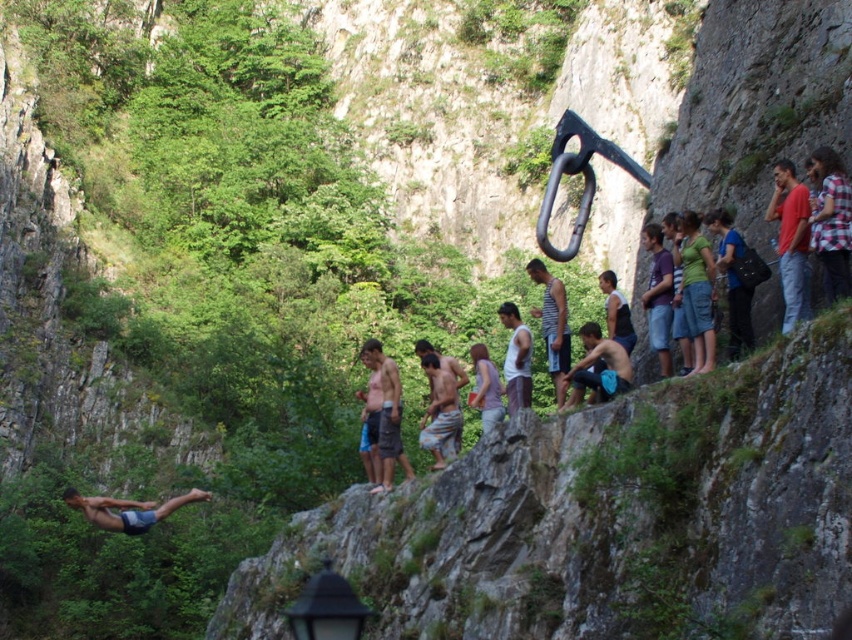
Question: Is the position of red cotton shirt at right more distant than that of striped tank top at center?

Choices:
 (A) no
 (B) yes

Answer: (A)

Question: Is blue denim shorts at lower left thinner than white tank top at center?

Choices:
 (A) no
 (B) yes

Answer: (A)

Question: Which of these objects is positioned farthest from the blue denim shorts at lower left?

Choices:
 (A) blue fabric shorts at center
 (B) white tank top at center

Answer: (A)

Question: Is red cotton shirt at right smaller than light brown woven shorts at center?

Choices:
 (A) no
 (B) yes

Answer: (B)

Question: Estimate the real-world distances between objects in this image. Which object is farther from the striped tank top at center?

Choices:
 (A) light brown woven shorts at center
 (B) blue denim shorts at lower left

Answer: (B)

Question: Which of these objects is positioned closest to the brown rock cliff at center?

Choices:
 (A) red cotton shirt at right
 (B) blue fabric shorts at center
 (C) light brown woven shorts at center
 (D) striped tank top at center

Answer: (B)